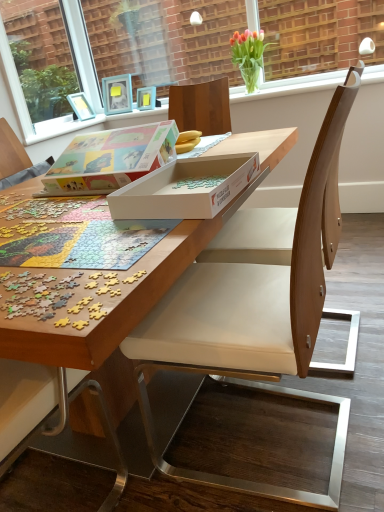
Question: Can white cardboard box at center, marked as the 1th box in a front-to-back arrangement, be found inside light brown wood chair at center?

Choices:
 (A) no
 (B) yes

Answer: (A)

Question: Does light brown wood chair at center have a greater width compared to white cardboard box at center, marked as the second box in a back-to-front arrangement?

Choices:
 (A) yes
 (B) no

Answer: (A)

Question: From the image's perspective, is light brown wood chair at center above white cardboard box at center, marked as the 1th box in a front-to-back arrangement?

Choices:
 (A) yes
 (B) no

Answer: (B)

Question: Can you confirm if light brown wood chair at center is positioned to the right of white cardboard box at center, marked as the second box in a back-to-front arrangement?

Choices:
 (A) no
 (B) yes

Answer: (B)

Question: Does light brown wood chair at center have a lesser width compared to white cardboard box at center, marked as the 1th box in a front-to-back arrangement?

Choices:
 (A) yes
 (B) no

Answer: (B)

Question: From a real-world perspective, is multicolored plastic jigsaw puzzle pieces at lower left above or below translucent glass vase at upper center?

Choices:
 (A) below
 (B) above

Answer: (A)

Question: Considering the positions of multicolored plastic jigsaw puzzle pieces at lower left and translucent glass vase at upper center in the image, is multicolored plastic jigsaw puzzle pieces at lower left taller or shorter than translucent glass vase at upper center?

Choices:
 (A) tall
 (B) short

Answer: (B)

Question: Which is correct: multicolored plastic jigsaw puzzle pieces at lower left is inside translucent glass vase at upper center, or outside of it?

Choices:
 (A) inside
 (B) outside

Answer: (B)

Question: In the image, is multicolored plastic jigsaw puzzle pieces at lower left on the left side or the right side of translucent glass vase at upper center?

Choices:
 (A) right
 (B) left

Answer: (B)

Question: Would you say translucent glass vase at upper center is inside or outside matte cardboard box at center, acting as the 2th box starting from the front?

Choices:
 (A) inside
 (B) outside

Answer: (B)

Question: Does point (248, 79) appear closer or farther from the camera than point (87, 151)?

Choices:
 (A) closer
 (B) farther

Answer: (B)

Question: Visually, is translucent glass vase at upper center positioned to the left or to the right of matte cardboard box at center, arranged as the first box when viewed from the back?

Choices:
 (A) right
 (B) left

Answer: (A)

Question: Is translucent glass vase at upper center in front of or behind matte cardboard box at center, acting as the 2th box starting from the front, in the image?

Choices:
 (A) front
 (B) behind

Answer: (B)

Question: Is translucent glass vase at upper center wider or thinner than wooden puzzle at center?

Choices:
 (A) thin
 (B) wide

Answer: (A)

Question: From the image's perspective, is translucent glass vase at upper center above or below wooden puzzle at center?

Choices:
 (A) above
 (B) below

Answer: (A)